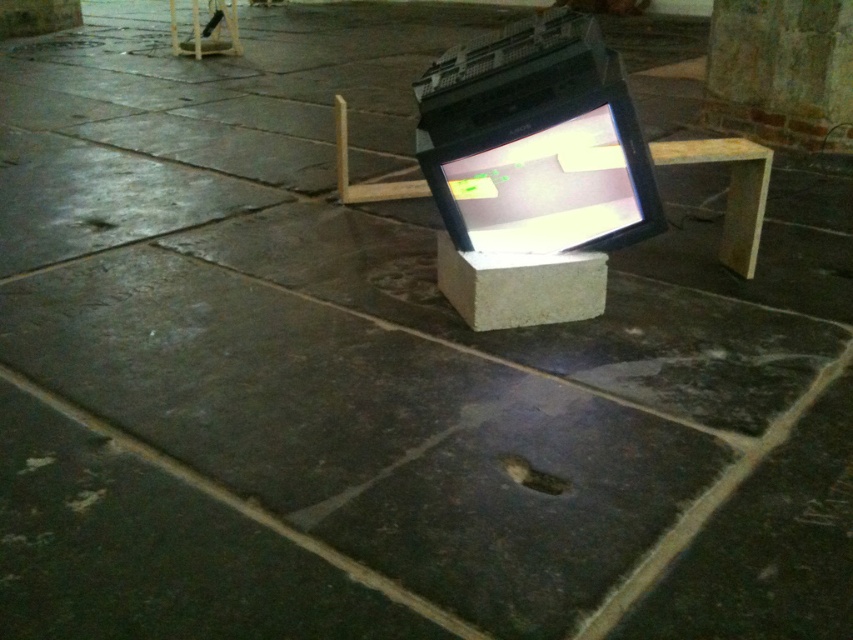
Measure the distance between point (515, 124) and camera.

Point (515, 124) is 7.87 feet from camera.

Who is more distant from viewer, (573,241) or (751,276)?

Point (751,276)

The image size is (853, 640). Describe the element at coordinates (549, 180) in the screenshot. I see `matte black monitor at center` at that location.

You are a GUI agent. You are given a task and a screenshot of the screen. Output one action in this format:
    pyautogui.click(x=<x>, y=<y>)
    Task: Click on the matte black monitor at center
    Image resolution: width=853 pixels, height=640 pixels.
    Given the screenshot: What is the action you would take?
    pyautogui.click(x=549, y=180)